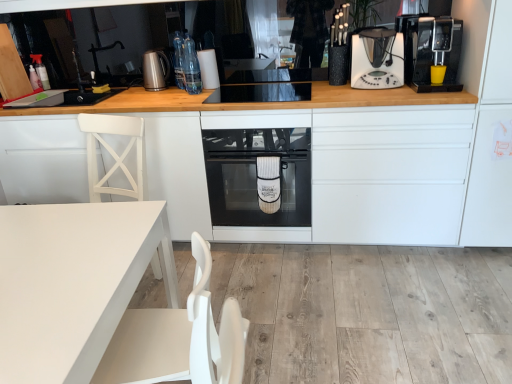
In order to click on vacant area situated to the left side of white plastic coffee maker at upper right, which appears as the 2th kitchen appliance when viewed from the left in this screenshot , I will do `click(332, 85)`.